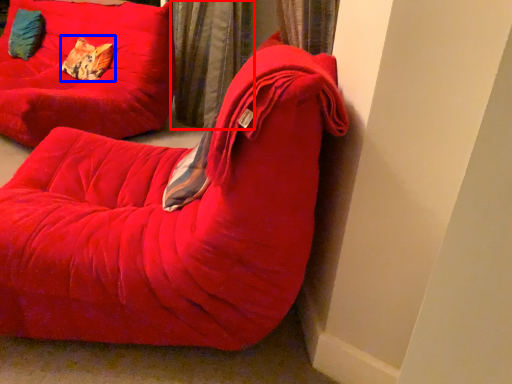
Question: Which object appears farthest to the camera in this image, curtain (highlighted by a red box) or pillow (highlighted by a blue box)?

Choices:
 (A) curtain
 (B) pillow

Answer: (B)